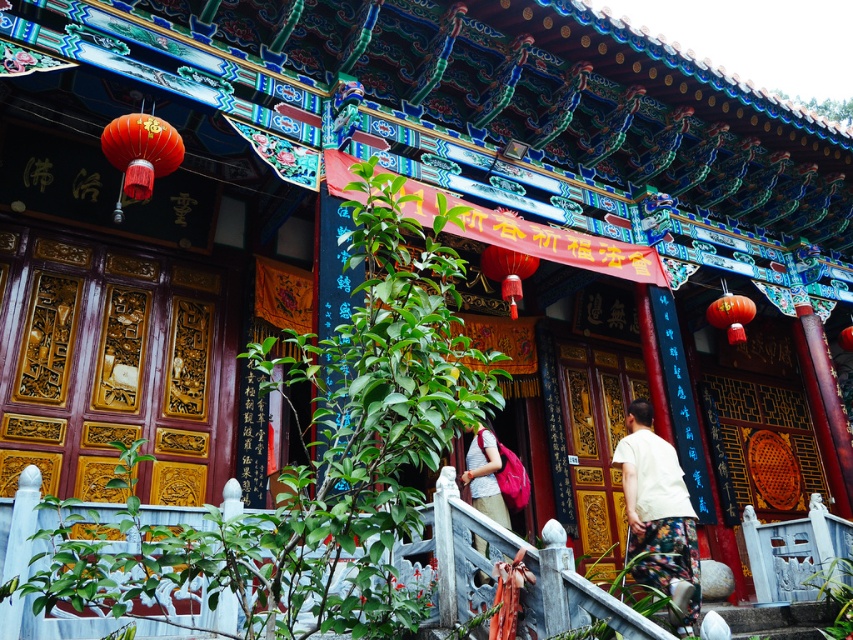
Question: Considering the relative positions of light yellow t-shirt at lower right and matte pink backpack at center in the image provided, where is light yellow t-shirt at lower right located with respect to matte pink backpack at center?

Choices:
 (A) below
 (B) above

Answer: (A)

Question: Estimate the real-world distances between objects in this image. Which object is closer to the light yellow t-shirt at lower right?

Choices:
 (A) white cotton shirt at center
 (B) matte pink backpack at center

Answer: (A)

Question: Can you confirm if light yellow t-shirt at lower right is positioned to the left of matte pink backpack at center?

Choices:
 (A) no
 (B) yes

Answer: (A)

Question: Which point is farther to the camera?

Choices:
 (A) matte pink backpack at center
 (B) white cotton shirt at center

Answer: (A)

Question: Which point is closer to the camera?

Choices:
 (A) (636, 509)
 (B) (496, 461)

Answer: (A)

Question: Is light yellow t-shirt at lower right thinner than white cotton shirt at center?

Choices:
 (A) no
 (B) yes

Answer: (A)